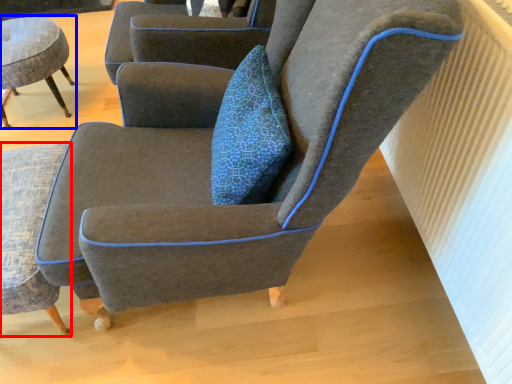
Question: Which object is further to the camera taking this photo, chair (highlighted by a red box) or chair (highlighted by a blue box)?

Choices:
 (A) chair
 (B) chair

Answer: (B)